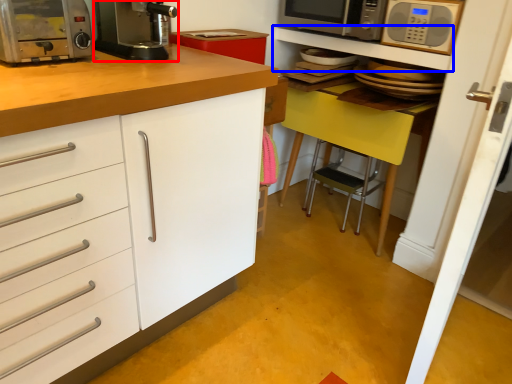
Question: Which object appears farthest to the camera in this image, kitchen appliance (highlighted by a red box) or shelf (highlighted by a blue box)?

Choices:
 (A) kitchen appliance
 (B) shelf

Answer: (B)